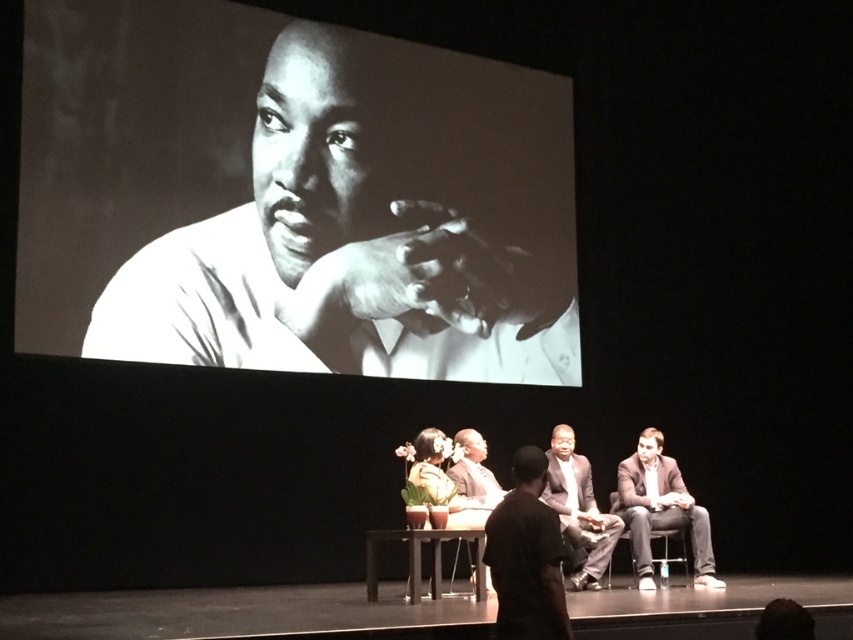
You are a photographer standing at the camera position. You want to capture a closeup of the light brown leather jacket at lower right. The camera can only focus on objects within 20 feet. Can you take the photo?

The light brown leather jacket at lower right is 23.76 feet from the camera, which is beyond the camera focus range of 20 feet. You cannot take the photo.

You are a photographer standing behind the stage. You need to take a photo of the dark gray suit at center and the dark brown suit at center so that both are clearly visible. Given that your camera has a minimum focus distance of 30 inches, will you be able to capture both suits in focus?

The dark gray suit at center and dark brown suit at center are 31.84 inches apart from each other, which is greater than the camera minimum focus distance of 30 inches. Therefore, the photographer can capture both suits in focus.